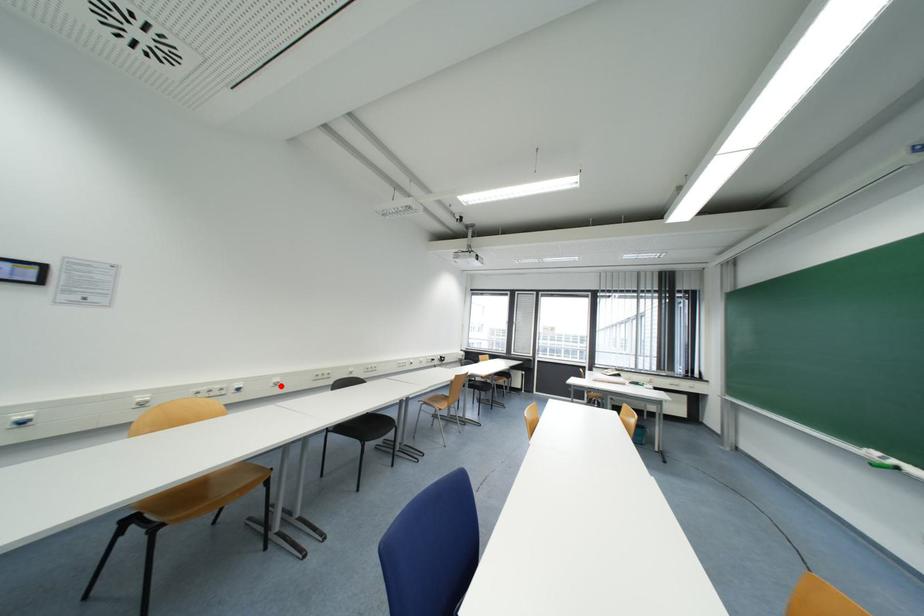
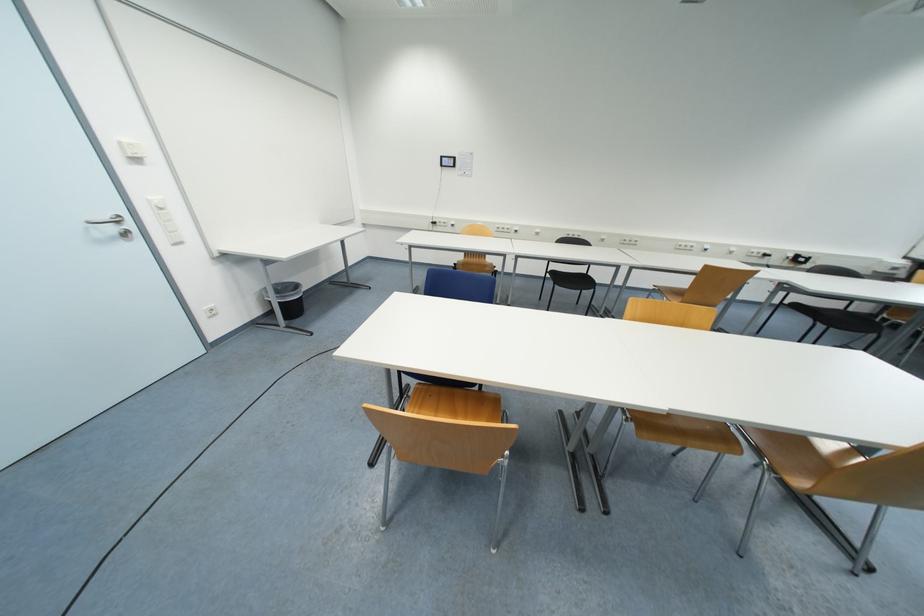
Question: I am providing you with two images of the same scene from different viewpoints. A red point is shown in image1. For the corresponding object point in image2, is it positioned nearer or farther from the camera?

Choices:
 (A) Nearer
 (B) Farther

Answer: (A)